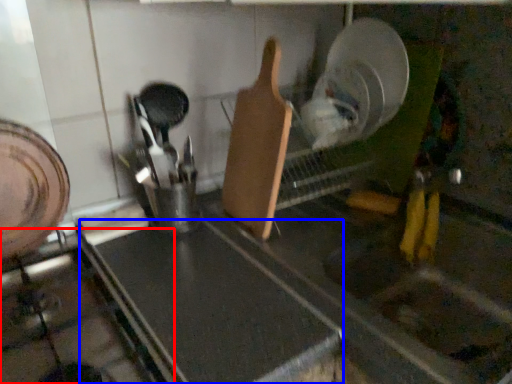
Question: Which object is closer to the camera taking this photo, gas stove (highlighted by a red box) or counter top (highlighted by a blue box)?

Choices:
 (A) gas stove
 (B) counter top

Answer: (A)